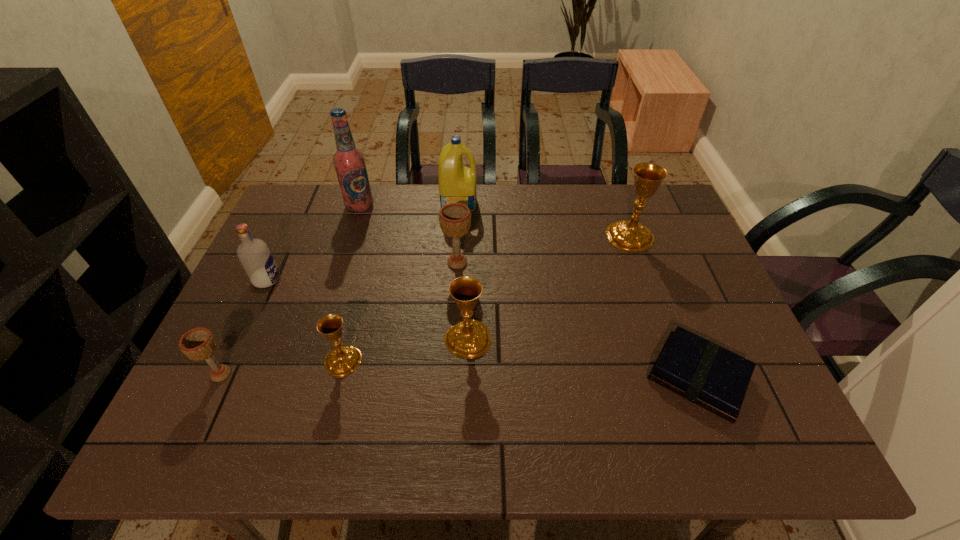
Find the location of a particular element. This screenshot has width=960, height=540. chalice at the right edge is located at coordinates (628, 235).

I want to click on book positioned at the right edge, so click(x=701, y=371).

At what (x,y) coordinates should I click in order to perform the action: click on object present at the far right corner. Please return your answer as a coordinate pair (x, y). The image size is (960, 540). Looking at the image, I should click on (628, 235).

Identify the location of object at the near right corner. (701, 371).

In the image, there is a desktop. Identify the location of vacant space at the far edge. (609, 196).

The image size is (960, 540). What are the coordinates of `vacant space at the near edge of the desktop` in the screenshot? It's located at (411, 450).

This screenshot has height=540, width=960. Find the location of `vacant space at the left edge`. vacant space at the left edge is located at coordinates (243, 329).

Locate an element on the screen. The width and height of the screenshot is (960, 540). free region at the right edge is located at coordinates (757, 392).

You are a GUI agent. You are given a task and a screenshot of the screen. Output one action in this format:
    pyautogui.click(x=<x>, y=<y>)
    Task: Click on the free space at the far left corner of the desktop
    The width and height of the screenshot is (960, 540).
    Given the screenshot: What is the action you would take?
    pyautogui.click(x=301, y=203)

This screenshot has width=960, height=540. In the image, there is a desktop. In order to click on blank space at the near left corner in this screenshot , I will do `click(215, 432)`.